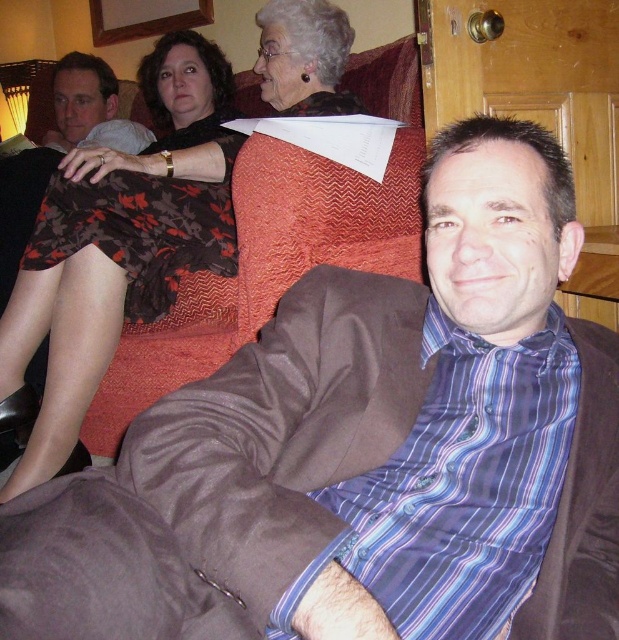
You are a photographer setting up for a group photo. You notice the printed fabric dress at upper left and the matte black skirt at upper left in the scene. Which of these two items is bigger in size?

The printed fabric dress at upper left is larger in size compared to the matte black skirt at upper left.

In the scene described, where is the printed fabric dress at upper left located in terms of coordinates?

The printed fabric dress at upper left is located at point (106, 276).